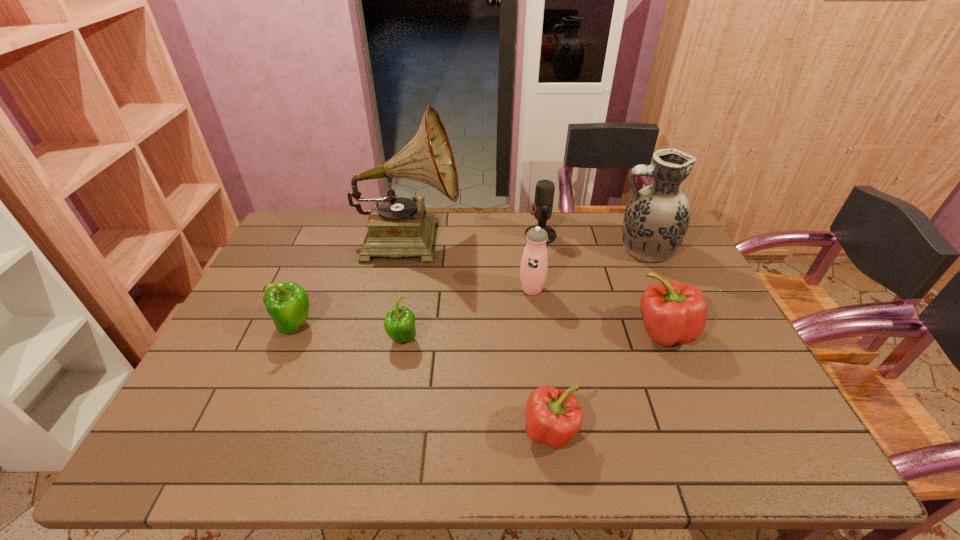
The width and height of the screenshot is (960, 540). Find the location of `record player`. record player is located at coordinates (397, 226).

The width and height of the screenshot is (960, 540). I want to click on the seventh shortest object, so click(x=656, y=219).

What are the coordinates of `vase` in the screenshot? It's located at (656, 219).

In order to click on the fifth nearest object in this screenshot , I will do `click(534, 264)`.

The width and height of the screenshot is (960, 540). I want to click on microphone, so click(x=542, y=207).

The width and height of the screenshot is (960, 540). I want to click on the bigger green bell pepper, so click(288, 304).

This screenshot has width=960, height=540. What are the coordinates of `the left green bell pepper` in the screenshot? It's located at (288, 304).

Identify the location of the farther pink bell pepper. This screenshot has height=540, width=960. (673, 312).

Locate an element on the screen. the rightmost bell pepper is located at coordinates (673, 312).

The height and width of the screenshot is (540, 960). Identify the location of the smaller green bell pepper. (399, 324).